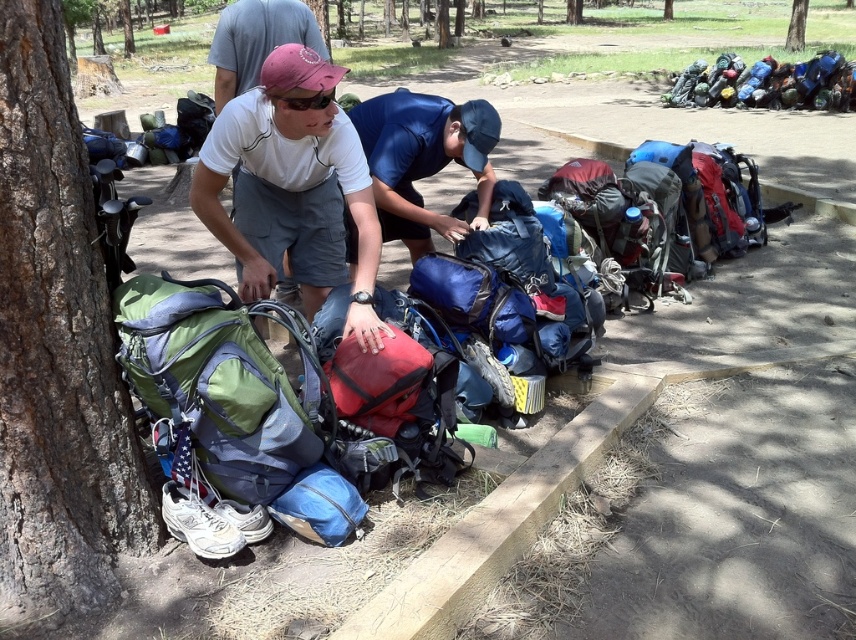
Can you confirm if matte white t-shirt at center is wider than blue fabric backpack at center?

Indeed, matte white t-shirt at center has a greater width compared to blue fabric backpack at center.

Is matte white t-shirt at center smaller than blue fabric backpack at center?

Correct, matte white t-shirt at center occupies less space than blue fabric backpack at center.

Where is `matte white t-shirt at center`? Image resolution: width=856 pixels, height=640 pixels. matte white t-shirt at center is located at coordinates (292, 188).

Locate an element on the screen. This screenshot has width=856, height=640. matte white t-shirt at center is located at coordinates (292, 188).

Can you confirm if brown wood curb at lower center is positioned above matte red backpack at center?

Incorrect, brown wood curb at lower center is not positioned above matte red backpack at center.

Is brown wood curb at lower center bigger than matte red backpack at center?

Yes.

Is point (496, 548) behind point (419, 448)?

No.

You are a GUI agent. You are given a task and a screenshot of the screen. Output one action in this format:
    pyautogui.click(x=<x>, y=<y>)
    Task: Click on the brown wood curb at lower center
    The height and width of the screenshot is (640, 856).
    Given the screenshot: What is the action you would take?
    pyautogui.click(x=532, y=500)

Can you confirm if matte red backpack at center is positioned below concrete curb at center right?

Yes, matte red backpack at center is below concrete curb at center right.

Can you confirm if matte red backpack at center is positioned to the left of concrete curb at center right?

Indeed, matte red backpack at center is positioned on the left side of concrete curb at center right.

Which is behind, point (415, 346) or point (809, 204)?

The point (809, 204) is behind.

Image resolution: width=856 pixels, height=640 pixels. I want to click on matte red backpack at center, so click(x=401, y=400).